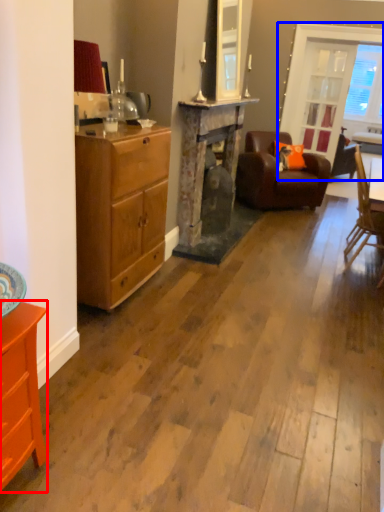
Question: Which object is closer to the camera taking this photo, cabinetry (highlighted by a red box) or window screen (highlighted by a blue box)?

Choices:
 (A) cabinetry
 (B) window screen

Answer: (A)